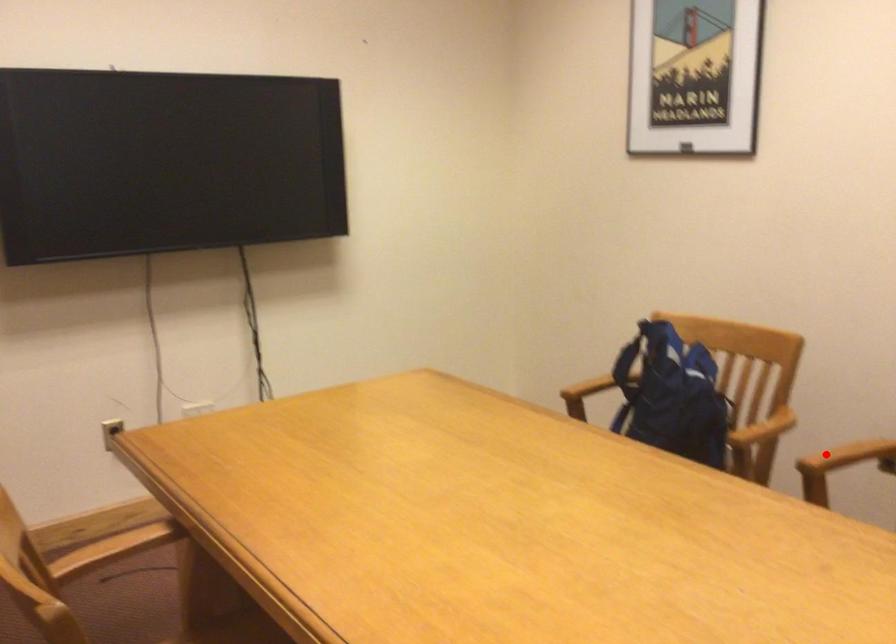
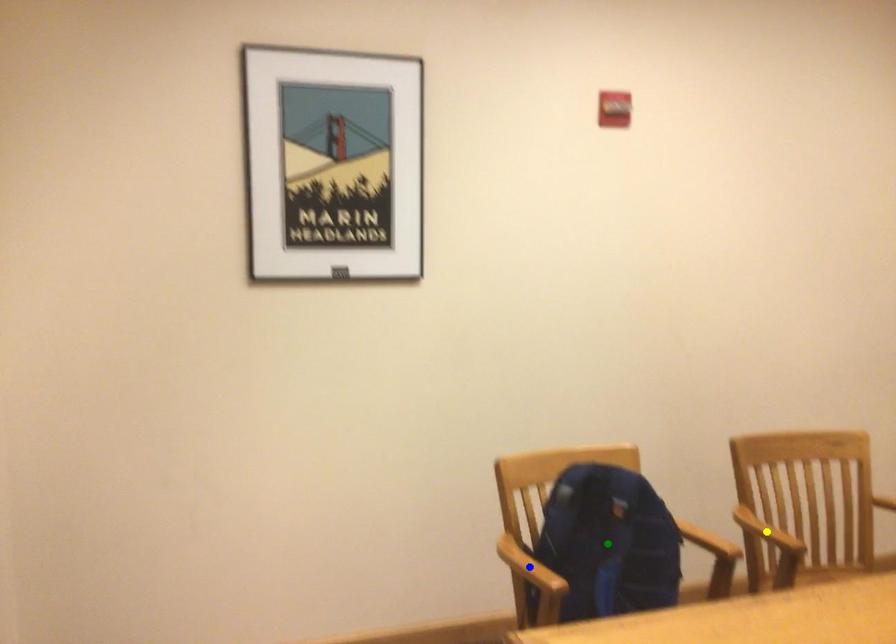
Question: I am providing you with two images of the same scene from different viewpoints. A red point is marked on the first image. You are given multiple points on the second image. Which spot in image 2 lines up with the point in image 1?

Choices:
 (A) green point
 (B) yellow point
 (C) blue point

Answer: (B)